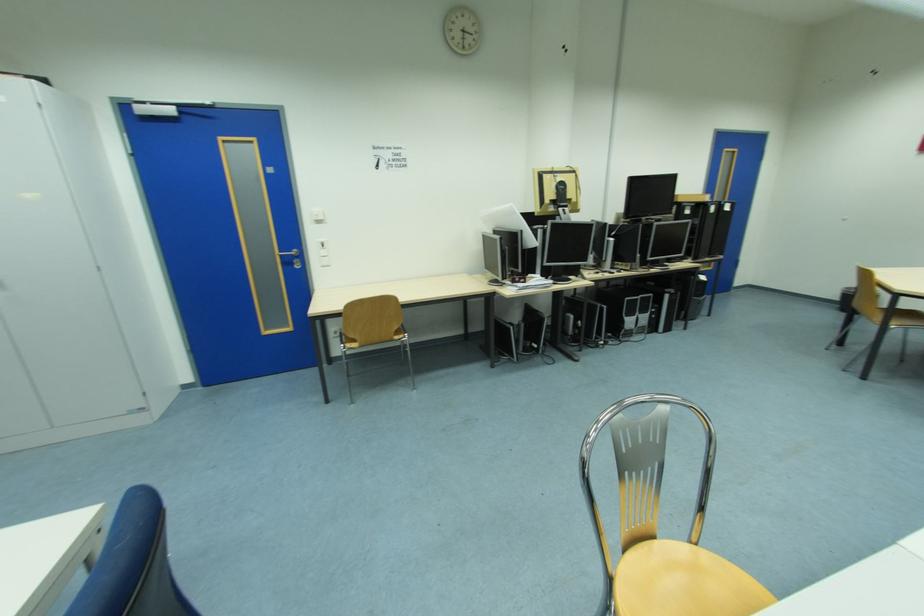
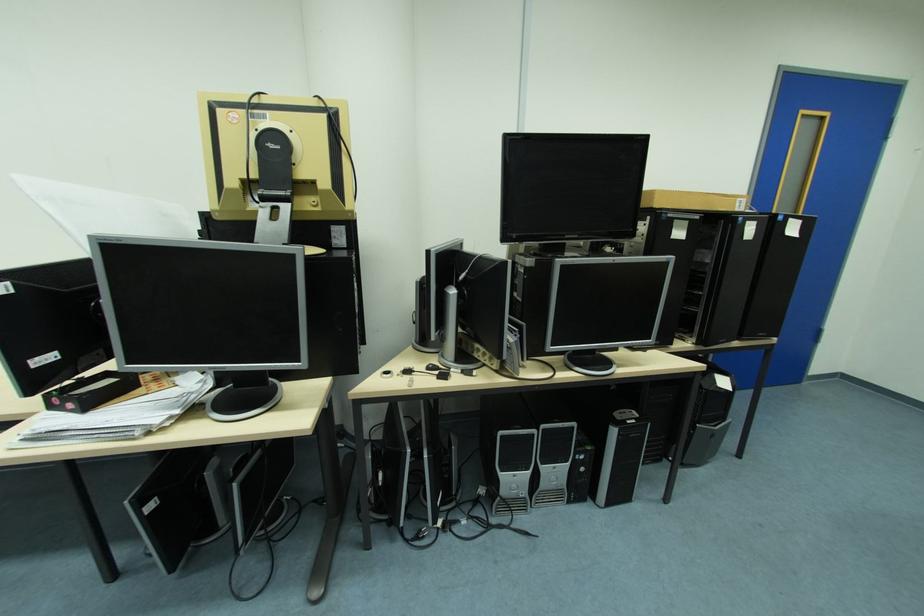
Find the pixel in the second image that matches the point at 675,297 in the first image.

(621, 432)